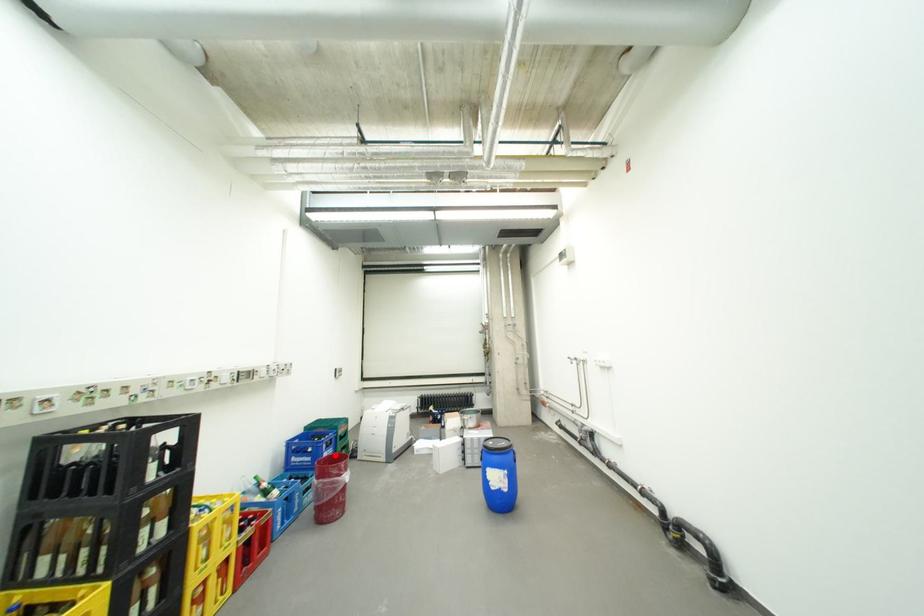
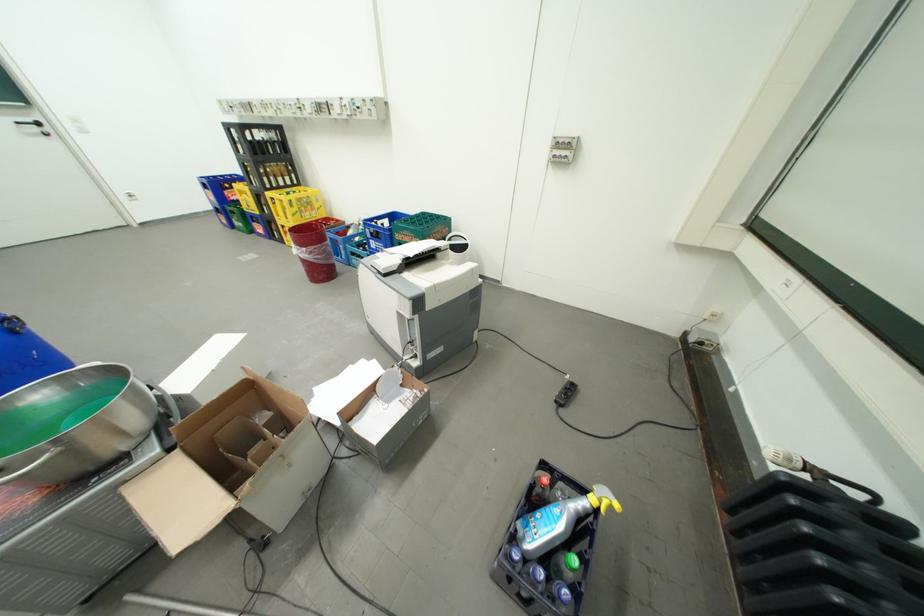
Where in the second image is the point corresponding to the highlighted location from the first image?

(381, 241)